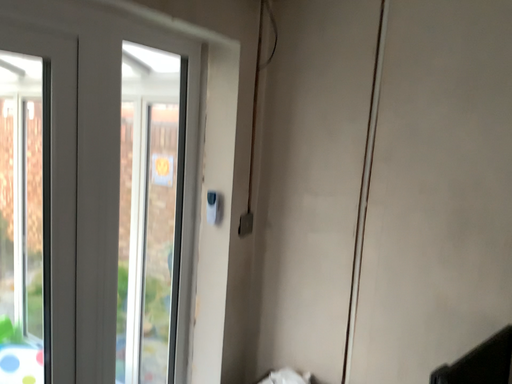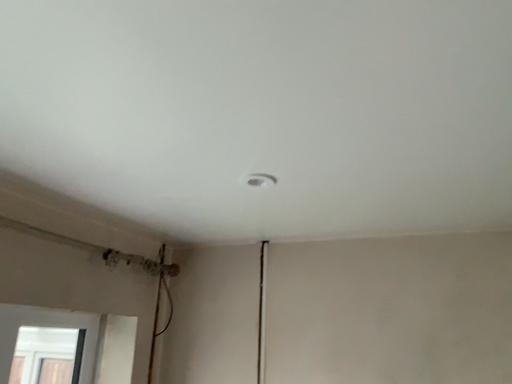
Question: Which way did the camera rotate in the video?

Choices:
 (A) rotated downward
 (B) rotated upward

Answer: (B)